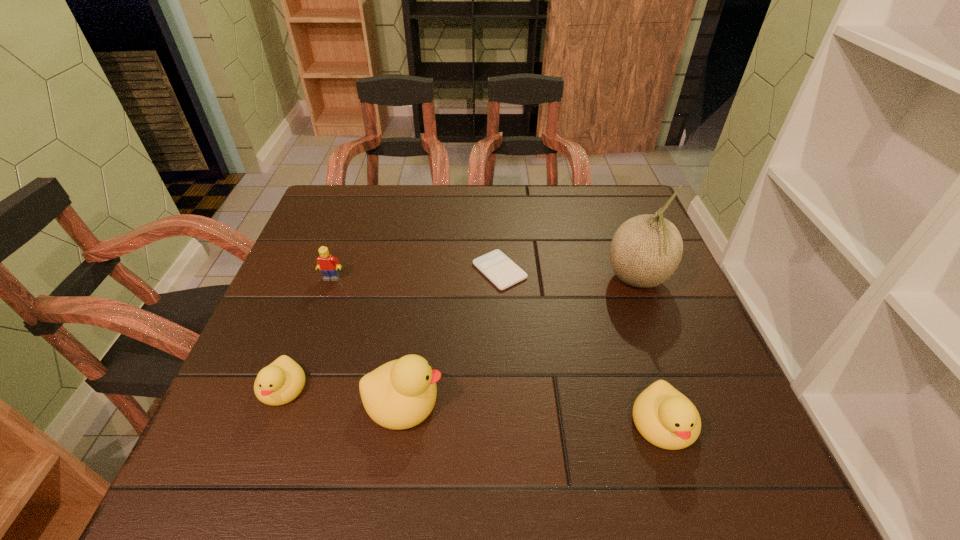
The image size is (960, 540). What are the coordinates of `free space that is in between the tallest duckling and the shortest object` in the screenshot? It's located at (452, 335).

Where is `free space between the Lego and the rightmost duckling`? free space between the Lego and the rightmost duckling is located at coordinates (497, 351).

Locate an element on the screen. free spot between the Lego and the calculator is located at coordinates (416, 274).

The image size is (960, 540). I want to click on free spot between the shortest object and the shortest duckling, so click(391, 329).

You are a GUI agent. You are given a task and a screenshot of the screen. Output one action in this format:
    pyautogui.click(x=<x>, y=<y>)
    Task: Click on the unoccupied area between the rightmost duckling and the calculator
    Image resolution: width=960 pixels, height=540 pixels.
    Given the screenshot: What is the action you would take?
    pyautogui.click(x=582, y=347)

Choose which object is the fifth nearest neighbor to the calculator. Please provide its 2D coordinates. Your answer should be formatted as a tuple, i.e. [(x, y)], where the tuple contains the x and y coordinates of a point satisfying the conditions above.

[(280, 382)]

Identify the location of object that ranks as the third closest to the third object from left to right. This screenshot has height=540, width=960. (329, 265).

Locate an element on the screen. Image resolution: width=960 pixels, height=540 pixels. duckling that stands as the closest to the calculator is located at coordinates (400, 394).

Select which duckling is the closest to the tallest object. Please provide its 2D coordinates. Your answer should be formatted as a tuple, i.e. [(x, y)], where the tuple contains the x and y coordinates of a point satisfying the conditions above.

[(666, 418)]

Identify the location of blank space that satisfies the following two spatial constraints: 1. on the front-facing side of the tallest object; 2. on the right side of the Lego. point(331,280).